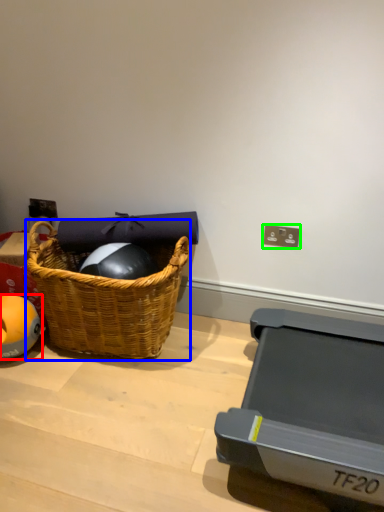
Question: Which is farther away from ball (highlighted by a red box)? picnic basket (highlighted by a blue box) or electric outlet (highlighted by a green box)?

Choices:
 (A) picnic basket
 (B) electric outlet

Answer: (B)